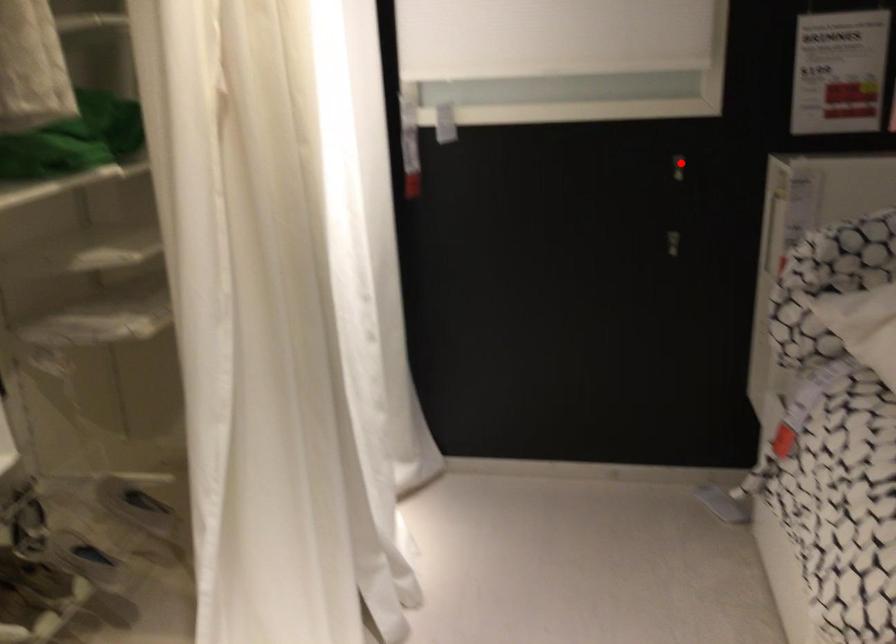
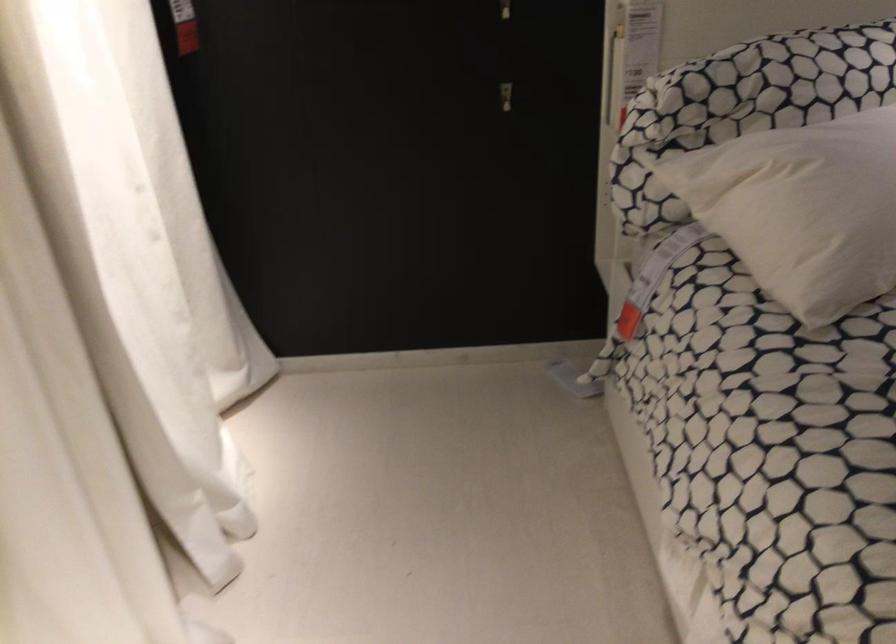
Find the pixel in the second image that matches the highlighted location in the first image.

(512, 14)